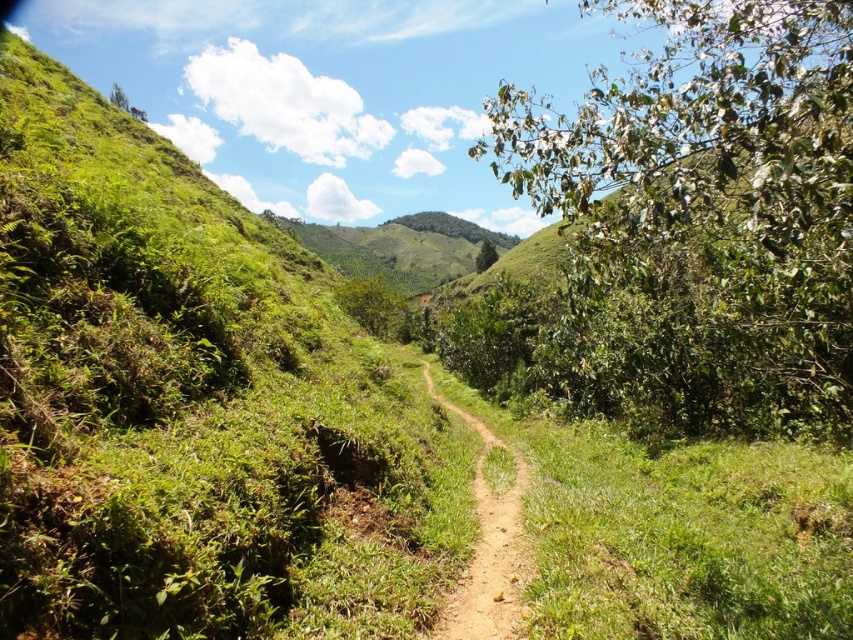
Question: Is the position of green leafy bush at right more distant than that of green leafy hill at center?

Choices:
 (A) yes
 (B) no

Answer: (B)

Question: Does green leafy bush at right appear under brown dirt track at center?

Choices:
 (A) yes
 (B) no

Answer: (B)

Question: Is green leafy bush at right further to camera compared to brown dirt track at center?

Choices:
 (A) yes
 (B) no

Answer: (B)

Question: Which object is positioned farthest from the brown dirt track at center?

Choices:
 (A) green leafy bush at right
 (B) green leafy hill at center

Answer: (B)

Question: Which point is closer to the camera taking this photo?

Choices:
 (A) click(x=601, y=403)
 (B) click(x=376, y=259)

Answer: (A)

Question: Among these objects, which one is nearest to the camera?

Choices:
 (A) brown dirt track at center
 (B) green leafy hill at center
 (C) green leafy bush at right

Answer: (C)